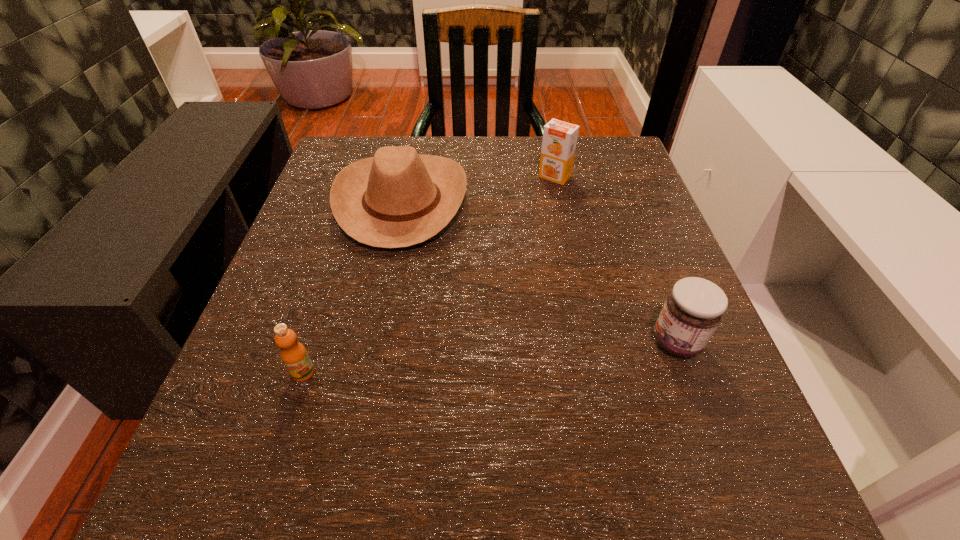
At what (x,y) coordinates should I click in order to perform the action: click on vacant space that's between the nearer orange juice and the jam. Please return your answer as a coordinate pair (x, y). The height and width of the screenshot is (540, 960). Looking at the image, I should click on (490, 357).

The width and height of the screenshot is (960, 540). Identify the location of unoccupied position between the jam and the left orange juice. (490, 357).

Where is `free point between the cowboy hat and the left orange juice`? This screenshot has height=540, width=960. free point between the cowboy hat and the left orange juice is located at coordinates (352, 287).

Identify the location of vacant space in between the farther orange juice and the shorter orange juice. This screenshot has height=540, width=960. tap(429, 274).

At what (x,y) coordinates should I click in order to perform the action: click on free space between the cowboy hat and the rightmost object. Please return your answer as a coordinate pair (x, y). Image resolution: width=960 pixels, height=540 pixels. Looking at the image, I should click on [x=540, y=272].

At what (x,y) coordinates should I click in order to perform the action: click on vacant area that lies between the cowboy hat and the taller orange juice. Please return your answer as a coordinate pair (x, y). Looking at the image, I should click on (478, 189).

Identify which object is the closest to the taller orange juice. Please provide its 2D coordinates. Your answer should be formatted as a tuple, i.e. [(x, y)], where the tuple contains the x and y coordinates of a point satisfying the conditions above.

[(398, 198)]

Locate an element on the screen. This screenshot has height=540, width=960. object that is the third closest to the taller orange juice is located at coordinates (293, 354).

Find the location of a particular element. The image size is (960, 540). vacant position in the image that satisfies the following two spatial constraints: 1. on the front label of the rightmost object; 2. on the front label of the left orange juice is located at coordinates (688, 373).

Locate an element on the screen. The width and height of the screenshot is (960, 540). free region that satisfies the following two spatial constraints: 1. on the front-facing side of the cowboy hat; 2. on the front label of the left orange juice is located at coordinates (368, 373).